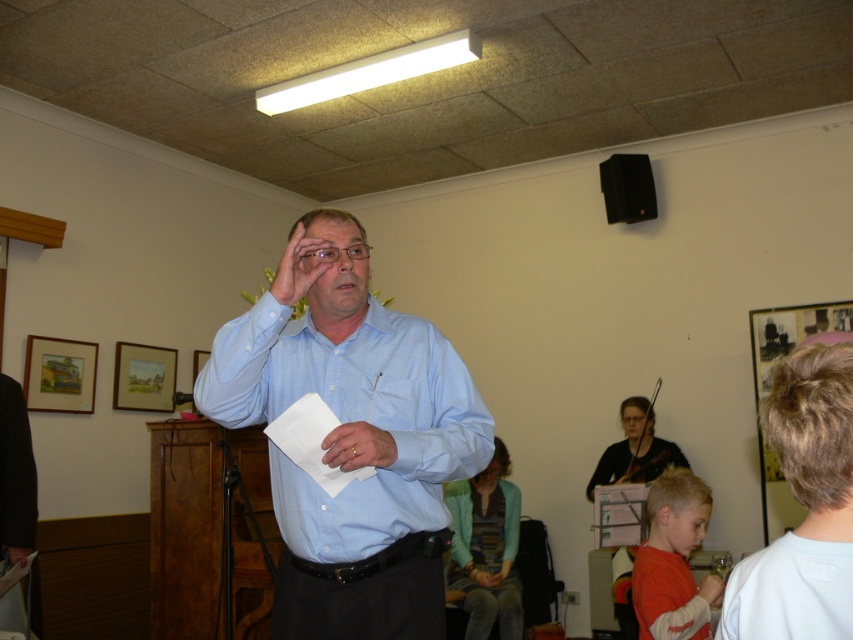
Question: Does white matte dress shirt at right have a larger size compared to gold metallic ring at center?

Choices:
 (A) no
 (B) yes

Answer: (B)

Question: Is light blue shirt at center smaller than orange cotton shirt at lower right?

Choices:
 (A) no
 (B) yes

Answer: (A)

Question: Which point appears farthest from the camera in this image?

Choices:
 (A) (349, 445)
 (B) (827, 401)

Answer: (A)

Question: Which point appears farthest from the camera in this image?

Choices:
 (A) (670, 621)
 (B) (819, 465)

Answer: (A)

Question: Is light blue shirt at center positioned before orange cotton shirt at lower right?

Choices:
 (A) yes
 (B) no

Answer: (A)

Question: Estimate the real-world distances between objects in this image. Which object is farther from the gold metallic ring at center?

Choices:
 (A) white matte dress shirt at right
 (B) orange cotton shirt at lower right
 (C) light blue shirt at center

Answer: (B)